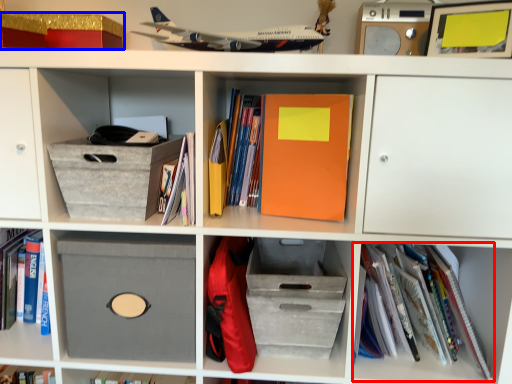
Question: Which object appears farthest to the camera in this image, book (highlighted by a red box) or storage box (highlighted by a blue box)?

Choices:
 (A) book
 (B) storage box

Answer: (B)